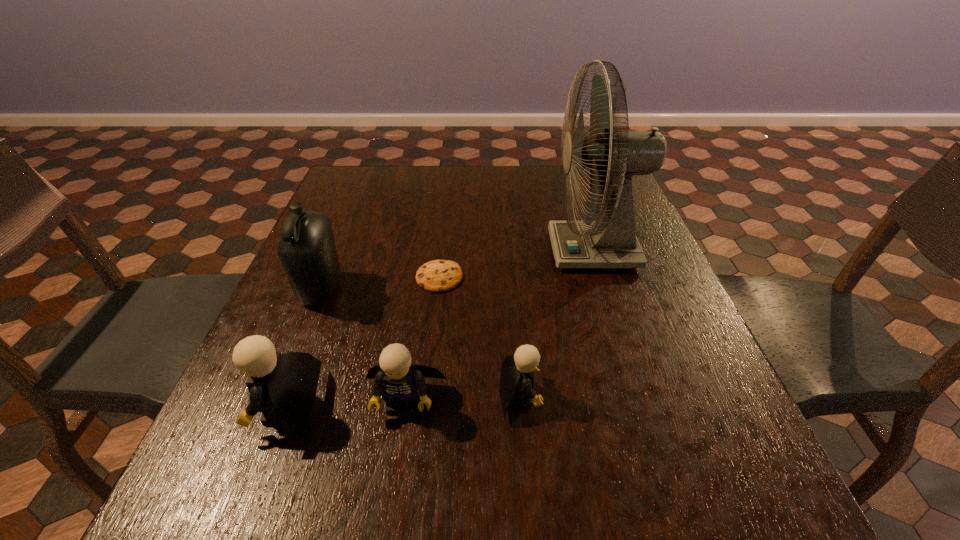
Where is `the leftmost Lego`? the leftmost Lego is located at coordinates (283, 387).

Identify the location of the second tallest Lego. The image size is (960, 540). (399, 380).

Where is `the third shortest object`? This screenshot has width=960, height=540. the third shortest object is located at coordinates (399, 380).

In order to click on the rightmost Lego in this screenshot , I will do `click(518, 370)`.

Identify the location of the shortest Lego. (518, 370).

Identify the location of fan. The height and width of the screenshot is (540, 960). (610, 242).

The height and width of the screenshot is (540, 960). In order to click on the rightmost object in this screenshot , I will do `click(610, 242)`.

Locate an element on the screen. The height and width of the screenshot is (540, 960). cookie is located at coordinates (438, 276).

Image resolution: width=960 pixels, height=540 pixels. I want to click on bottle, so click(x=307, y=250).

Find the location of a particular element. This screenshot has height=540, width=960. free space located 0.070m on the front-facing side of the second shortest object is located at coordinates (579, 395).